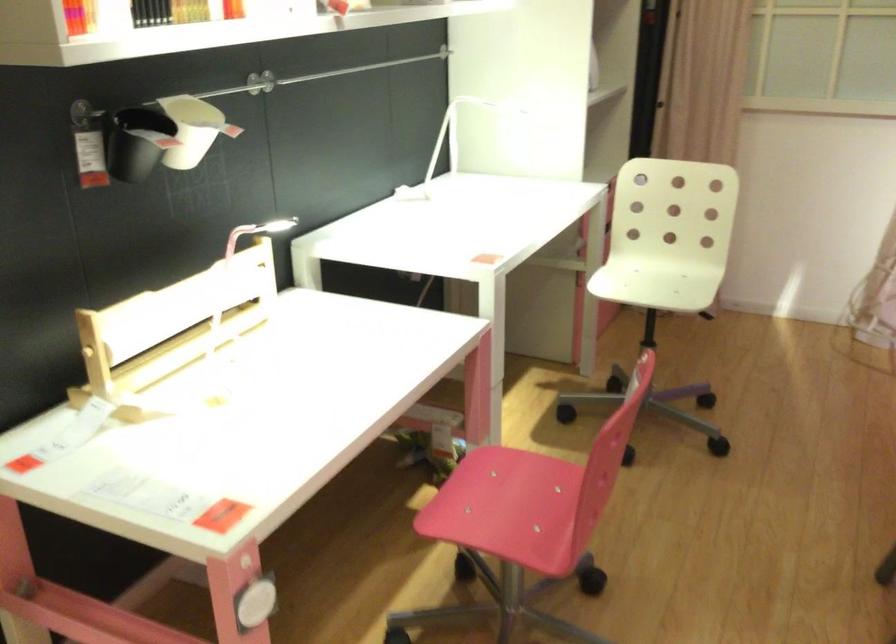
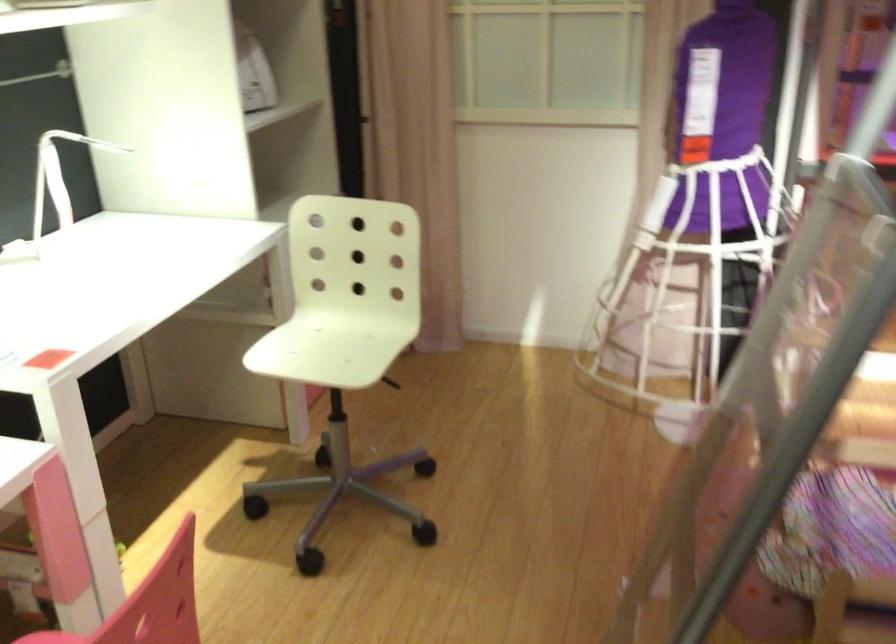
In the second image, find the point that corresponds to point 450,136 in the first image.

(58, 176)